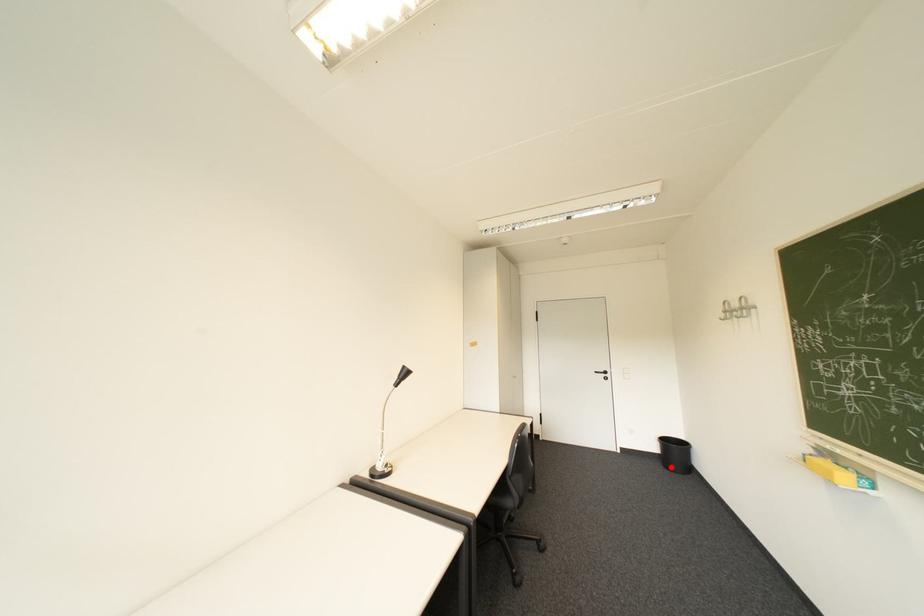
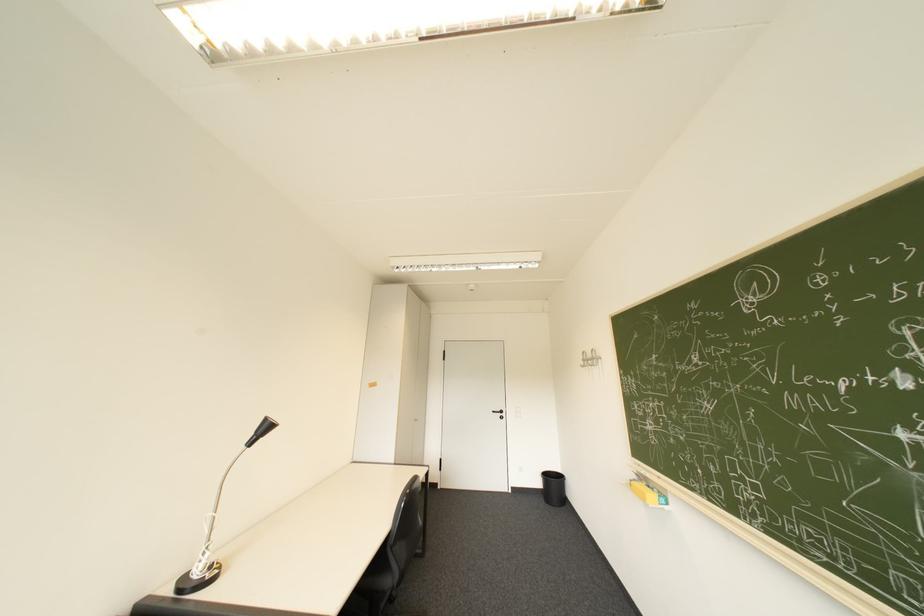
Question: A red point is marked in image1. In image2, is the corresponding 3D point closer to the camera or farther? Reply with the corresponding letter.

Choices:
 (A) The corresponding 3D point is closer.
 (B) The corresponding 3D point is farther.

Answer: (B)